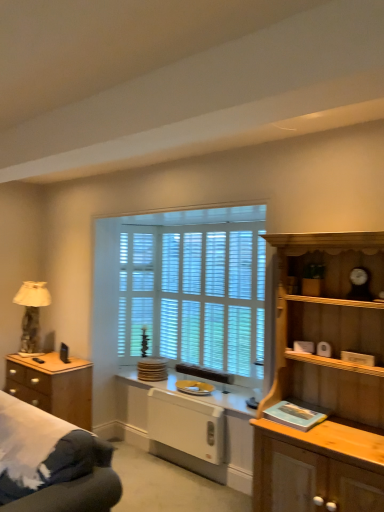
Question: In the image, is white glossy countertop at center positioned in front of or behind brown wooden chest of drawers at left?

Choices:
 (A) behind
 (B) front

Answer: (B)

Question: Considering the positions of white glossy countertop at center and brown wooden chest of drawers at left in the image, is white glossy countertop at center taller or shorter than brown wooden chest of drawers at left?

Choices:
 (A) tall
 (B) short

Answer: (B)

Question: Estimate the real-world distances between objects in this image. Which object is farther from the brown wooden chest of drawers at left?

Choices:
 (A) white glossy radiator at lower center, which is the 2th appliance from top to bottom
 (B) white wooden blinds at center
 (C) white wood blinds at center
 (D) white glossy plate at center, which is counted as the 2th appliance, starting from the bottom
 (E) light wood cabinet at right

Answer: (E)

Question: Based on their relative distances, which object is farther from the white glossy countertop at center?

Choices:
 (A) white plastic radiator at lower center
 (B) light wood cabinet at right
 (C) brown wooden chest of drawers at left
 (D) beige fabric lampshade at left
 (E) white glossy radiator at lower center, which is the 2th appliance from top to bottom

Answer: (D)